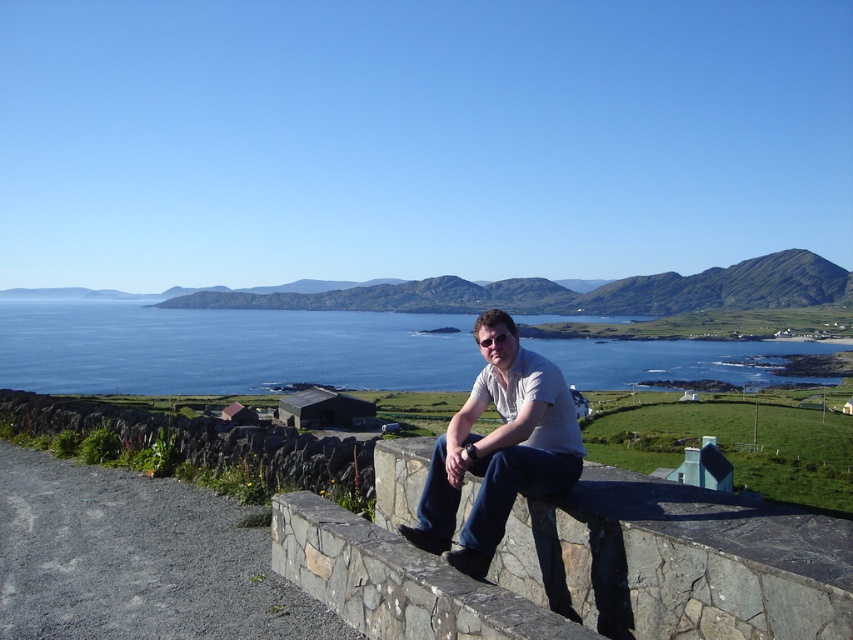
Question: Can you confirm if blue water at center is positioned below white cotton shirt at center?

Choices:
 (A) no
 (B) yes

Answer: (A)

Question: Which of the following is the farthest from the observer?

Choices:
 (A) blue water at center
 (B) white cotton shirt at center

Answer: (A)

Question: Which of the following is the farthest from the observer?

Choices:
 (A) blue water at center
 (B) white cotton shirt at center

Answer: (A)

Question: Can you confirm if blue water at center is positioned below white cotton shirt at center?

Choices:
 (A) no
 (B) yes

Answer: (A)

Question: Does blue water at center have a larger size compared to white cotton shirt at center?

Choices:
 (A) no
 (B) yes

Answer: (B)